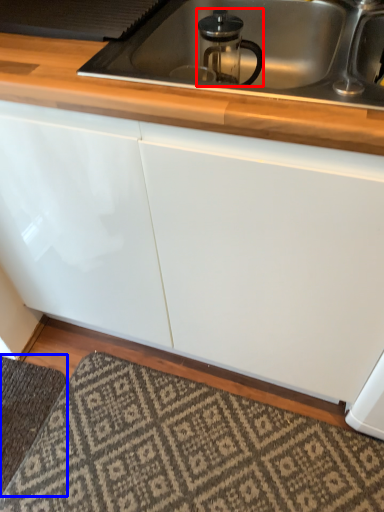
Question: Which object is further to the camera taking this photo, appliance (highlighted by a red box) or doormat (highlighted by a blue box)?

Choices:
 (A) appliance
 (B) doormat

Answer: (B)